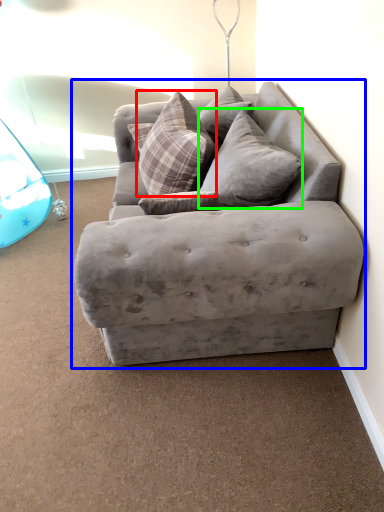
Question: Which object is the closest to the pillow (highlighted by a red box)? Choose among these: studio couch (highlighted by a blue box) or pillow (highlighted by a green box).

Choices:
 (A) studio couch
 (B) pillow

Answer: (B)